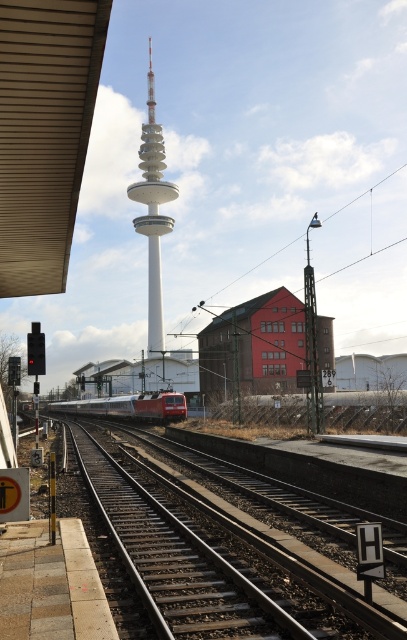
In the scene shown: Does smooth metal train track at center have a larger size compared to white smooth tower at center?

Incorrect, smooth metal train track at center is not larger than white smooth tower at center.

Can you confirm if smooth metal train track at center is thinner than white smooth tower at center?

Yes.

I want to click on smooth metal train track at center, so click(214, 563).

Where is `smooth metal train track at center`? Image resolution: width=407 pixels, height=640 pixels. smooth metal train track at center is located at coordinates (214, 563).

Between smooth metal train track at center and red glossy train at center, which one has more height?

red glossy train at center is taller.

The image size is (407, 640). I want to click on smooth metal train track at center, so click(x=214, y=563).

Can you confirm if white smooth tower at center is shorter than red glossy train at center?

In fact, white smooth tower at center may be taller than red glossy train at center.

Which is in front, point (140, 196) or point (133, 400)?

Point (133, 400) is in front.

Identify the location of white smooth tower at center. (153, 211).

Where is `white smooth tower at center`? The image size is (407, 640). white smooth tower at center is located at coordinates (153, 211).